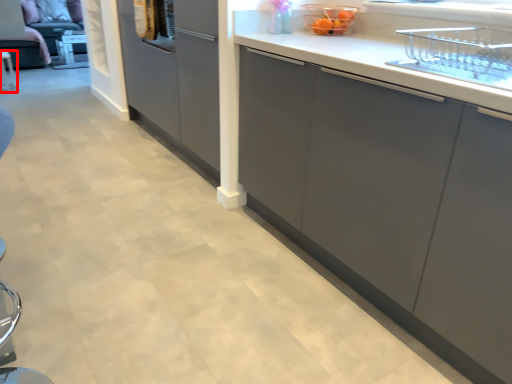
Question: From the image's perspective, considering the relative positions of furniture (annotated by the red box) and appliance in the image provided, where is furniture (annotated by the red box) located with respect to the staircase?

Choices:
 (A) above
 (B) below

Answer: (A)